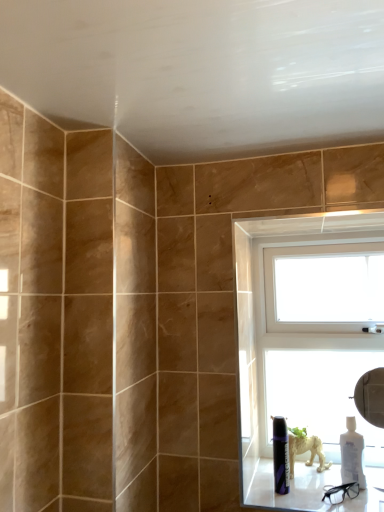
Where is `vacant space to the right of matte black can at lower right`? The width and height of the screenshot is (384, 512). vacant space to the right of matte black can at lower right is located at coordinates (339, 494).